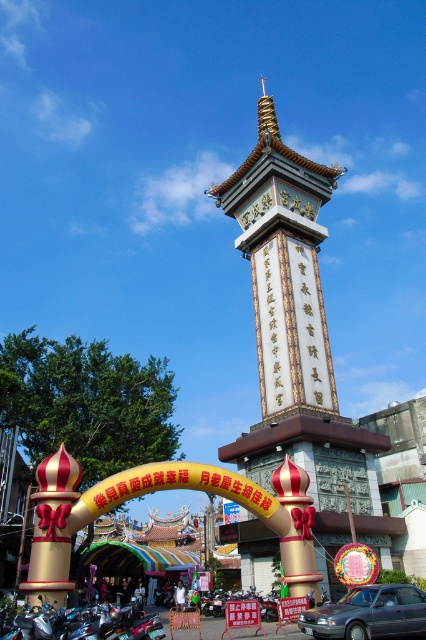
Is white stone tower at center smaller than metallic gray sedan at lower right?

Incorrect, white stone tower at center is not smaller in size than metallic gray sedan at lower right.

Who is positioned more to the left, white stone tower at center or metallic gray sedan at lower right?

white stone tower at center

Between point (344, 529) and point (380, 609), which one is positioned in front?

Point (380, 609) is more forward.

This screenshot has width=426, height=640. In order to click on white stone tower at center in this screenshot , I will do `click(299, 346)`.